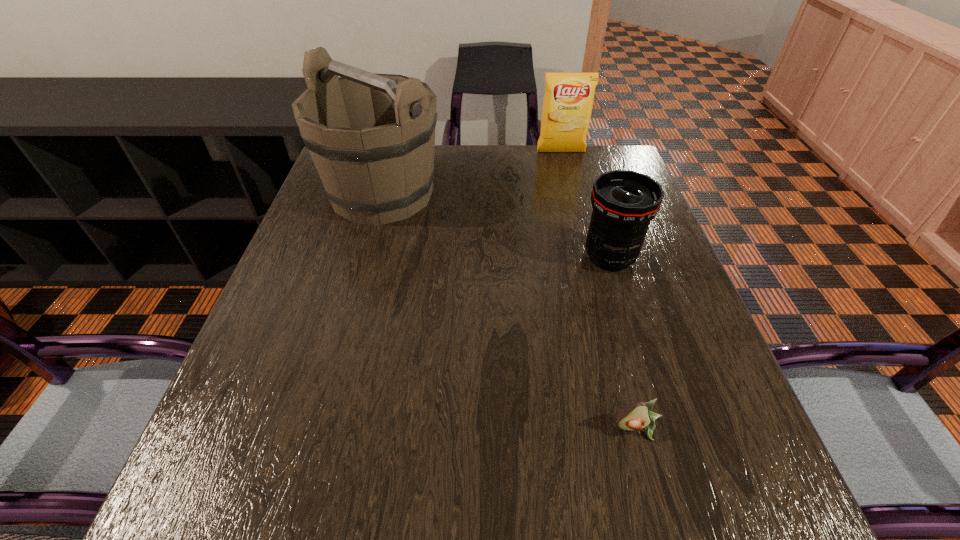
Where is `free space between the third farthest object and the farthest object`? The width and height of the screenshot is (960, 540). free space between the third farthest object and the farthest object is located at coordinates (586, 205).

Identify the location of vacant area between the crisp (potato chip) and the nearest object. Image resolution: width=960 pixels, height=540 pixels. tap(599, 290).

In order to click on free area in between the second shortest object and the bucket in this screenshot , I will do `click(496, 226)`.

You are a GUI agent. You are given a task and a screenshot of the screen. Output one action in this format:
    pyautogui.click(x=<x>, y=<y>)
    Task: Click on the free spot between the second shortest object and the nearest object
    The width and height of the screenshot is (960, 540).
    Given the screenshot: What is the action you would take?
    pyautogui.click(x=624, y=343)

Locate an element on the screen. free area in between the avocado and the third farthest object is located at coordinates (624, 343).

What are the coordinates of `empty space between the telephoto lens and the nearest object` in the screenshot? It's located at (624, 343).

Choose which object is the third nearest neighbor to the farthest object. Please provide its 2D coordinates. Your answer should be formatted as a tuple, i.e. [(x, y)], where the tuple contains the x and y coordinates of a point satisfying the conditions above.

[(636, 416)]

Select which object is the closest to the nearest object. Please provide its 2D coordinates. Your answer should be formatted as a tuple, i.e. [(x, y)], where the tuple contains the x and y coordinates of a point satisfying the conditions above.

[(624, 202)]